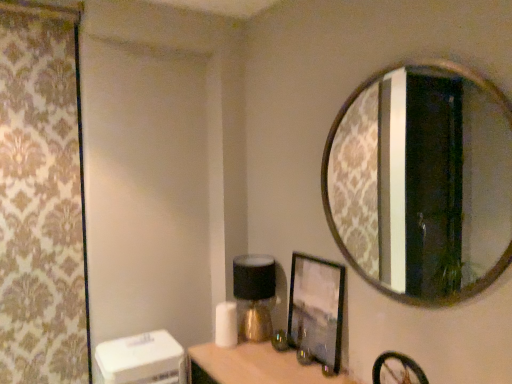
Question: Is matte black picture frame at center shorter than gold-framed mirror at upper right?

Choices:
 (A) yes
 (B) no

Answer: (A)

Question: From a real-world perspective, is matte black picture frame at center located beneath gold-framed mirror at upper right?

Choices:
 (A) yes
 (B) no

Answer: (A)

Question: Is matte black picture frame at center further to camera compared to gold-framed mirror at upper right?

Choices:
 (A) yes
 (B) no

Answer: (A)

Question: Is matte black picture frame at center smaller than gold-framed mirror at upper right?

Choices:
 (A) yes
 (B) no

Answer: (A)

Question: Is matte black picture frame at center far from gold-framed mirror at upper right?

Choices:
 (A) no
 (B) yes

Answer: (B)

Question: Is matte black picture frame at center in front of gold-framed mirror at upper right?

Choices:
 (A) yes
 (B) no

Answer: (B)

Question: Considering the relative sizes of gold-framed mirror at upper right and matte gold table lamp at center in the image provided, is gold-framed mirror at upper right taller than matte gold table lamp at center?

Choices:
 (A) yes
 (B) no

Answer: (A)

Question: From the image's perspective, is gold-framed mirror at upper right under matte gold table lamp at center?

Choices:
 (A) no
 (B) yes

Answer: (A)

Question: Is gold-framed mirror at upper right positioned beyond the bounds of matte gold table lamp at center?

Choices:
 (A) no
 (B) yes

Answer: (B)

Question: Is matte gold table lamp at center located within gold-framed mirror at upper right?

Choices:
 (A) yes
 (B) no

Answer: (B)

Question: Is gold-framed mirror at upper right shorter than matte gold table lamp at center?

Choices:
 (A) yes
 (B) no

Answer: (B)

Question: Is gold-framed mirror at upper right next to matte gold table lamp at center and touching it?

Choices:
 (A) no
 (B) yes

Answer: (A)

Question: From the image's perspective, is matte black picture frame at center below patterned fabric curtain at left?

Choices:
 (A) no
 (B) yes

Answer: (B)